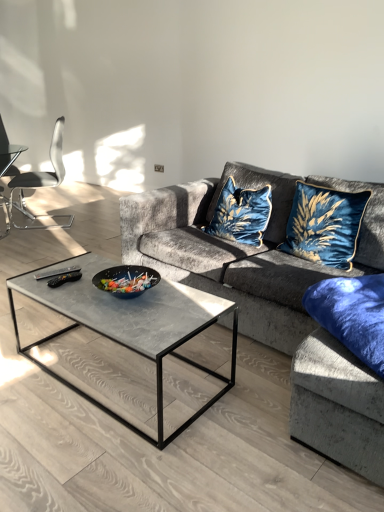
The image size is (384, 512). What are the coordinates of `unoccupied area behind metallic silver chair at left` in the screenshot? It's located at (51, 202).